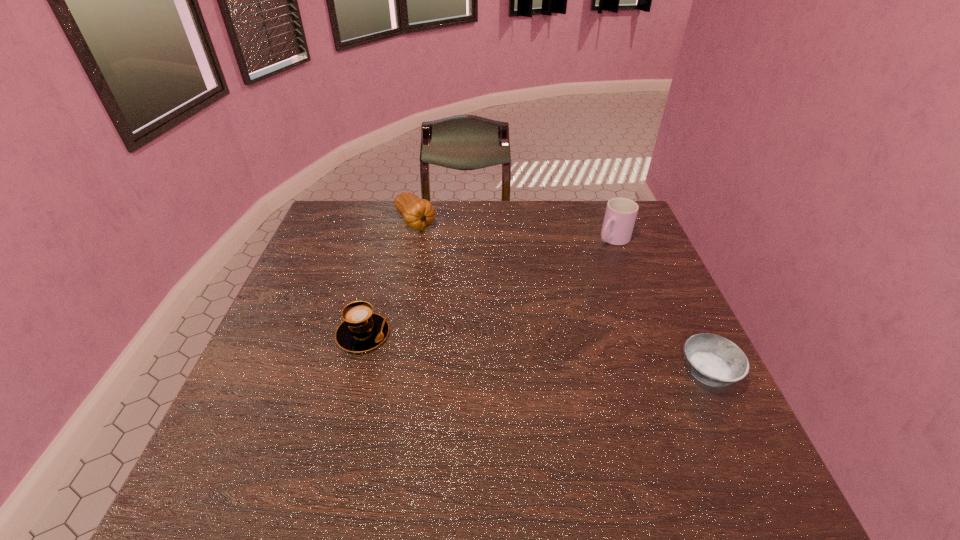
This screenshot has height=540, width=960. In order to click on cappuccino in this screenshot , I will do `click(362, 330)`.

Locate an element on the screen. the shortest object is located at coordinates (716, 361).

The image size is (960, 540). I want to click on cup, so coord(620,215).

Where is `gourd`? gourd is located at coordinates (418, 214).

The image size is (960, 540). I want to click on free location located on the back of the cappuccino, so click(x=385, y=253).

Where is `free space located 0.180m on the back of the shortest object`? The image size is (960, 540). free space located 0.180m on the back of the shortest object is located at coordinates (672, 298).

At what (x,y) coordinates should I click in order to perform the action: click on free spot located 0.260m with the handle on the side of the cup. Please return your answer as a coordinate pair (x, y). The height and width of the screenshot is (540, 960). Looking at the image, I should click on (554, 288).

Locate an element on the screen. Image resolution: width=960 pixels, height=540 pixels. vacant space situated 0.270m with the handle on the side of the cup is located at coordinates (551, 291).

Image resolution: width=960 pixels, height=540 pixels. In order to click on blank area located 0.240m with the handle on the side of the cup in this screenshot , I will do `click(558, 285)`.

Where is `blank space located 0.380m on the stem side of the gourd`? The height and width of the screenshot is (540, 960). blank space located 0.380m on the stem side of the gourd is located at coordinates (488, 308).